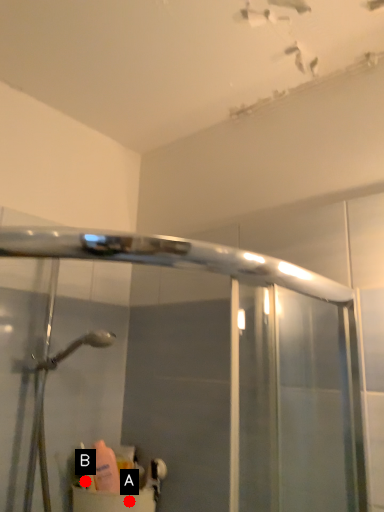
Question: Two points are circled on the image, labeled by A and B beside each circle. Among these points, which one is nearest to the camera?

Choices:
 (A) A is closer
 (B) B is closer

Answer: (B)